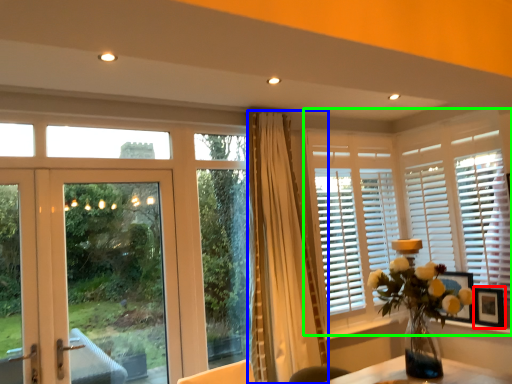
Question: Which object is positioned closest to picture frame (highlighted by a red box)? Select from curtain (highlighted by a blue box) and window (highlighted by a green box).

Choices:
 (A) curtain
 (B) window

Answer: (B)